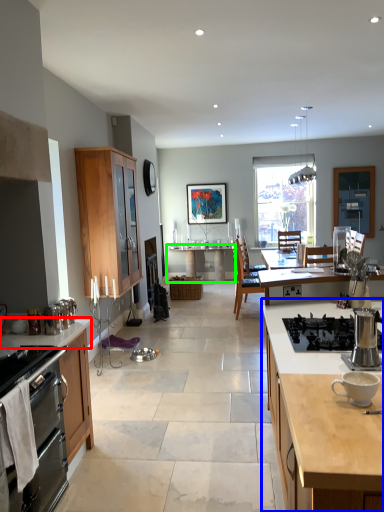
Question: Which object is the farthest from countertop (highlighted by a red box)? Choose among these: cabinetry (highlighted by a blue box) or table (highlighted by a green box).

Choices:
 (A) cabinetry
 (B) table

Answer: (B)